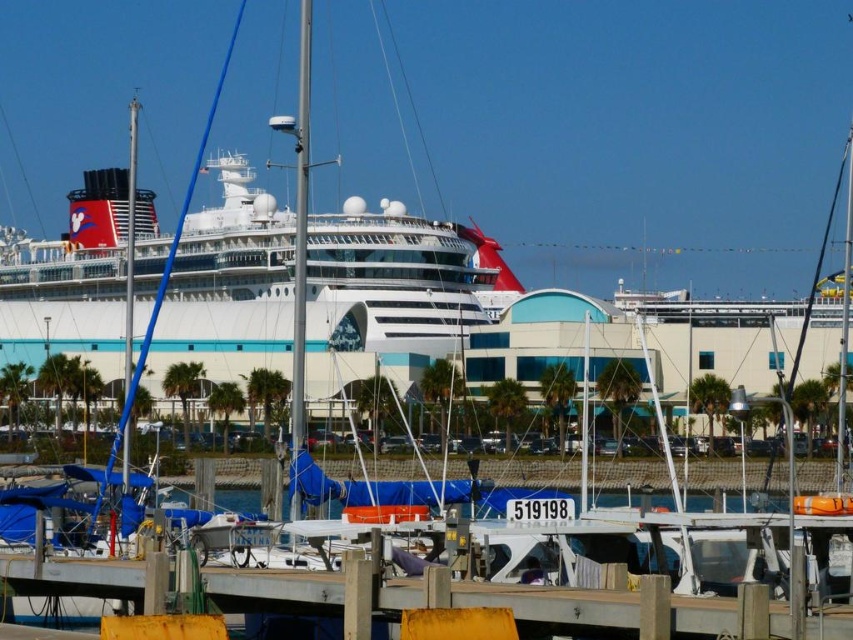
Question: Is white glossy cruise ship at center bigger than yellow painted wood at lower center?

Choices:
 (A) no
 (B) yes

Answer: (B)

Question: Which point appears farthest from the camera in this image?

Choices:
 (A) (96, 561)
 (B) (358, 252)

Answer: (B)

Question: Which point is closer to the camera taking this photo?

Choices:
 (A) tap(334, 595)
 (B) tap(192, 289)

Answer: (A)

Question: Can you confirm if white glossy cruise ship at center is smaller than yellow painted wood at lower center?

Choices:
 (A) yes
 (B) no

Answer: (B)

Question: Is white glossy cruise ship at center to the left of yellow painted wood at lower center from the viewer's perspective?

Choices:
 (A) yes
 (B) no

Answer: (A)